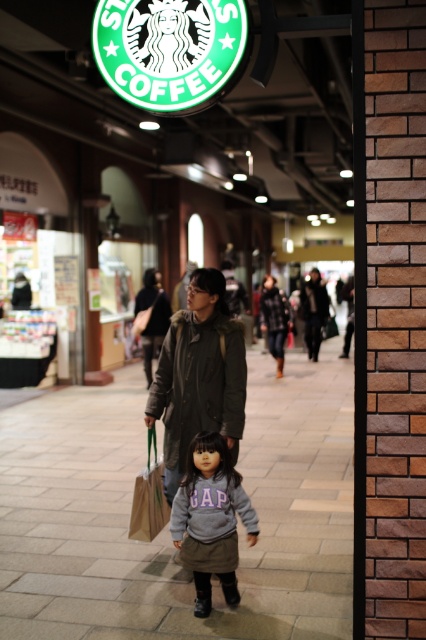
You are standing in the shopping arcade and see the dark green textured coat at center. If you want to place a small package exactly where the coat is, where should you place it?

You should place the small package at point (x=198, y=376), which is the location of the dark green textured coat at center.

Looking at this image, you are standing at the entrance of the shopping arcade and see the dark green textured coat at center. There is a Starbucks Coffee sign at the top left corner. How far apart are these two objects?

The dark green textured coat at center and the Starbucks Coffee sign at the top left corner are 13.54 feet apart.